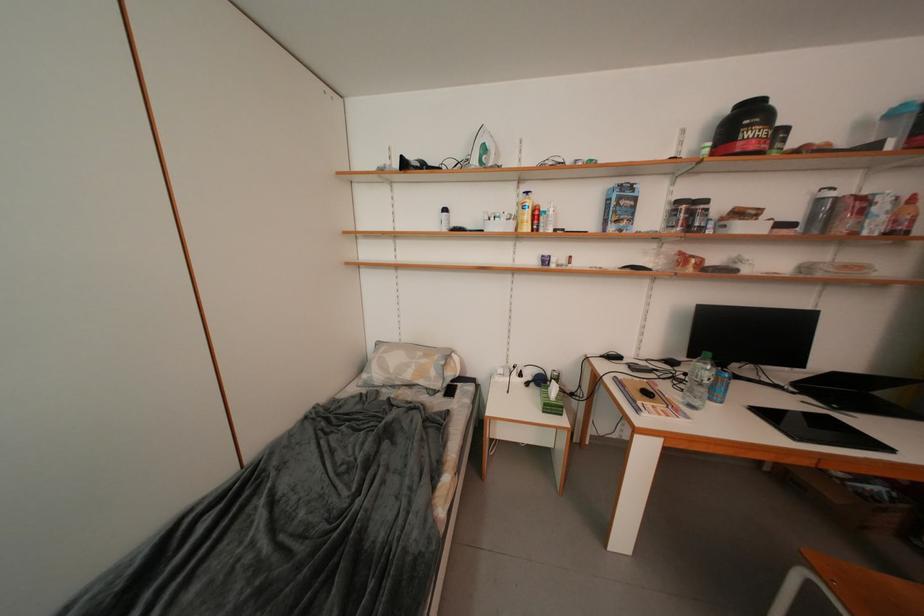
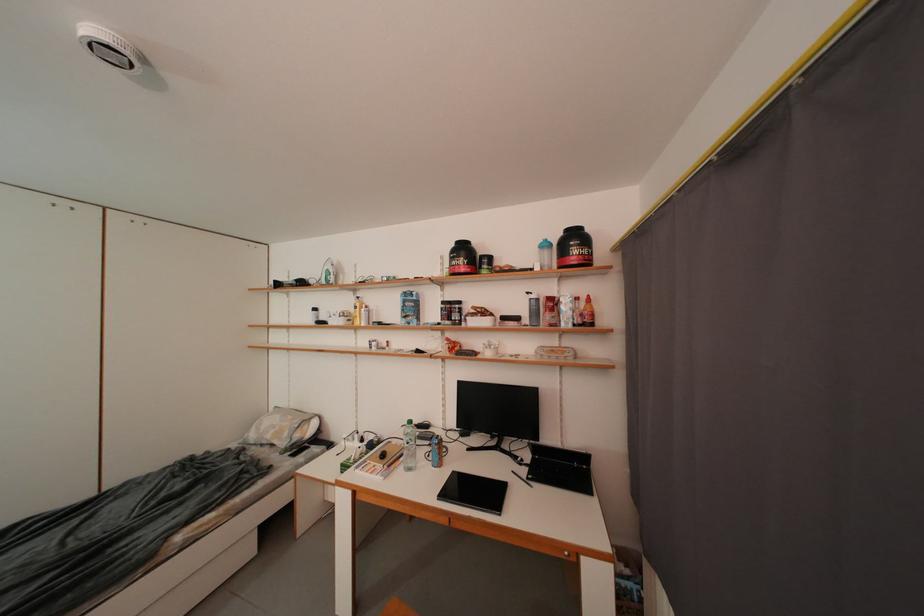
Locate, in the second image, the point that corresponds to the point at 701,270 in the first image.

(457, 355)